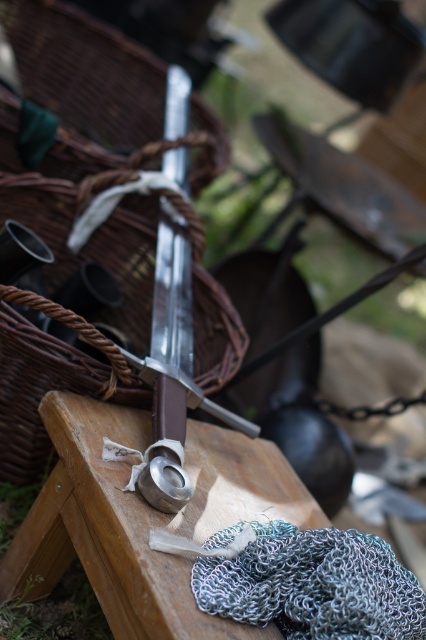
Question: Observing the image, what is the correct spatial positioning of brown woven basket at center in reference to wooden table at center?

Choices:
 (A) above
 (B) below

Answer: (A)

Question: Which object appears closest to the camera in this image?

Choices:
 (A) polished silver sword at center
 (B) chainmail at center
 (C) wooden table at center
 (D) brown woven basket at center

Answer: (C)

Question: Which of the following is the closest to the observer?

Choices:
 (A) (123, 522)
 (B) (175, 125)

Answer: (A)

Question: Observing the image, what is the correct spatial positioning of wooden table at center in reference to polished silver sword at center?

Choices:
 (A) left
 (B) right

Answer: (B)

Question: Which point is closer to the camera?

Choices:
 (A) (209, 592)
 (B) (221, 428)
 (C) (172, 296)
 (D) (26, 198)

Answer: (A)

Question: Is wooden table at center closer to the viewer compared to polished silver sword at center?

Choices:
 (A) yes
 (B) no

Answer: (A)